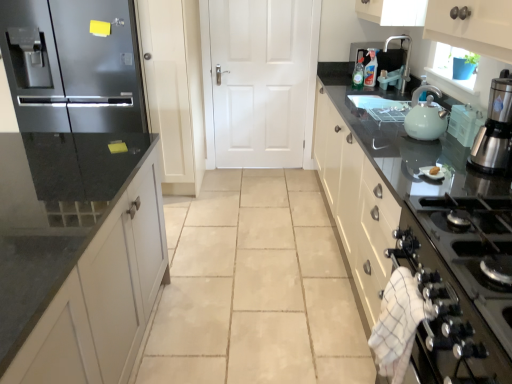
I want to click on blank space situated above white matte door at center (from a real-world perspective), so [261, 1].